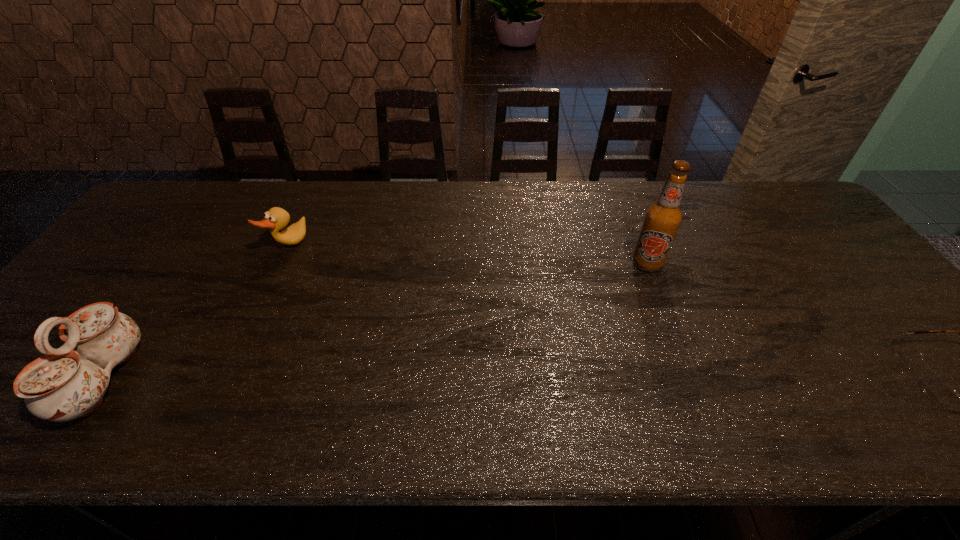
You are a GUI agent. You are given a task and a screenshot of the screen. Output one action in this format:
    pyautogui.click(x=<x>, y=<y>)
    Task: Click on the free space on the desktop that is between the chinaware and the rightmost object and is positioned on the beak of the third object from right to left
    The height and width of the screenshot is (540, 960).
    Given the screenshot: What is the action you would take?
    pyautogui.click(x=525, y=379)

Identify the location of free space on the desktop that is between the third shortest object and the shortest object and is positioned on the front label of the beer bottle. Image resolution: width=960 pixels, height=540 pixels. (575, 379).